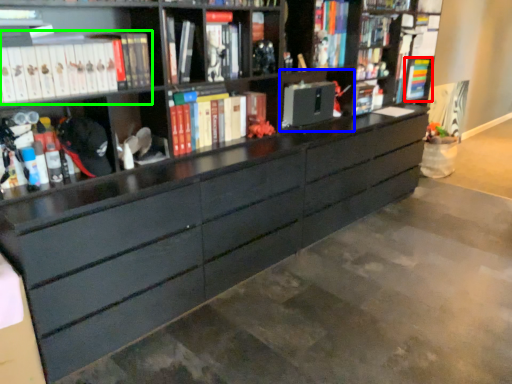
Question: Which is nearer to the book (highlighted by a red box)? cabinet (highlighted by a blue box) or book (highlighted by a green box).

Choices:
 (A) cabinet
 (B) book

Answer: (A)